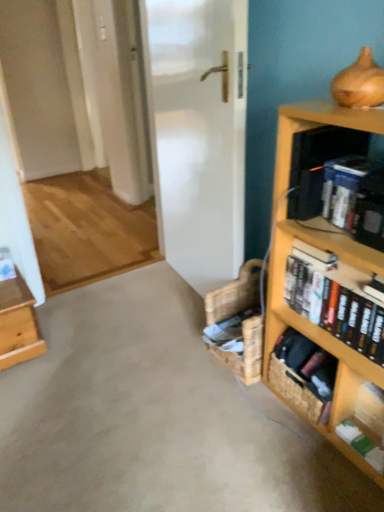
Image resolution: width=384 pixels, height=512 pixels. I want to click on free space in front of light brown wooden table at left, so click(x=30, y=380).